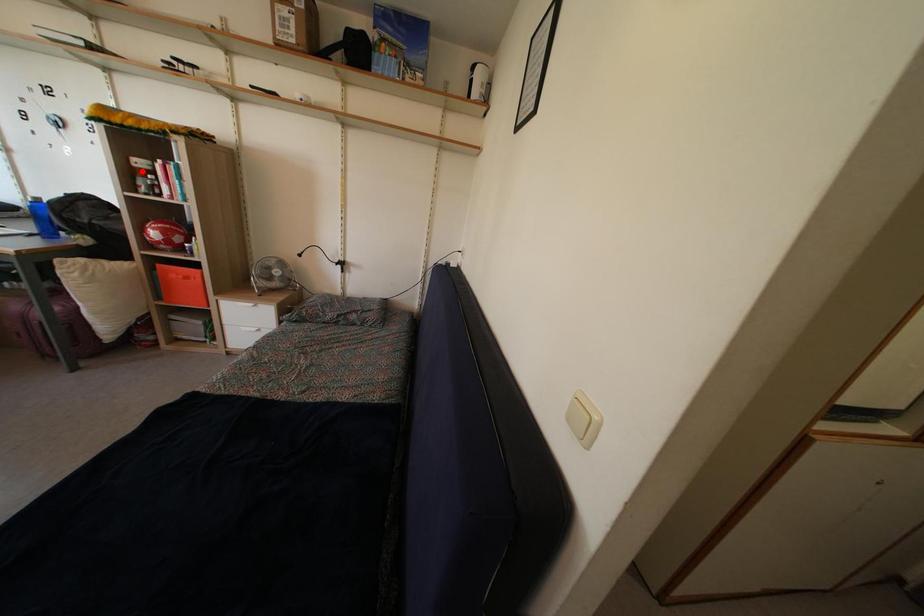
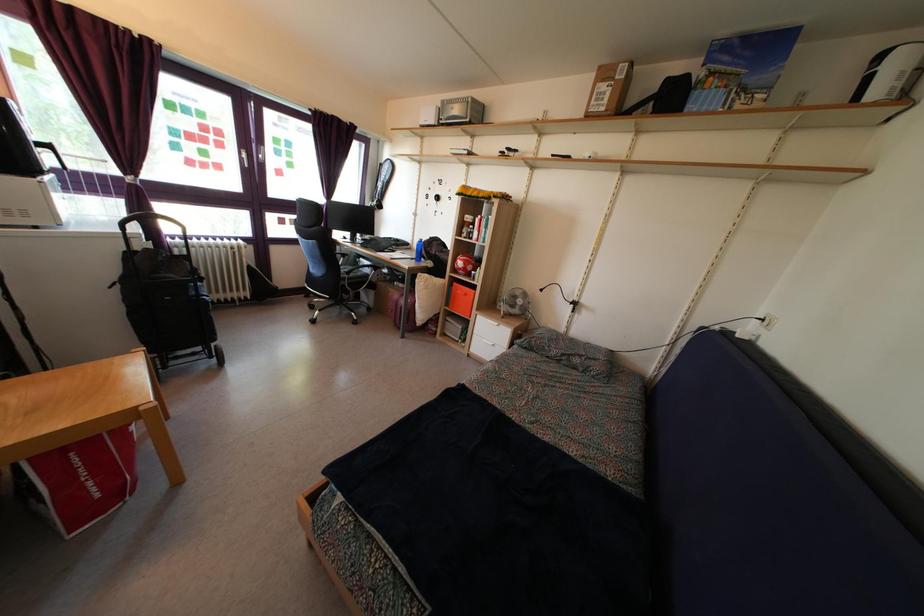
Question: A red point is marked in image1. In image2, is the corresponding 3D point closer to the camera or farther? Reply with the corresponding letter.

Choices:
 (A) The corresponding 3D point is closer.
 (B) The corresponding 3D point is farther.

Answer: (A)